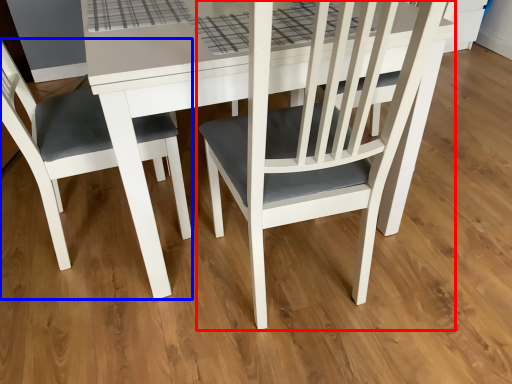
Question: Among these objects, which one is nearest to the camera, chair (highlighted by a red box) or chair (highlighted by a blue box)?

Choices:
 (A) chair
 (B) chair

Answer: (B)